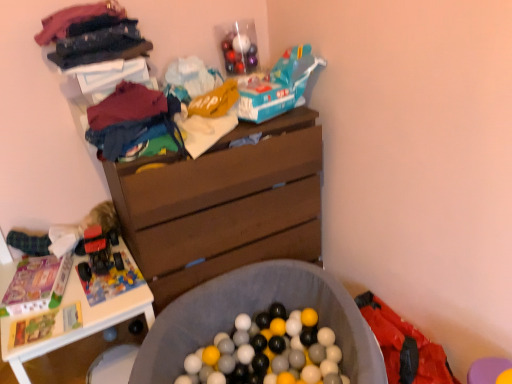
In order to click on shiny red plastic toy car at left, which is the 2th toy car from right to left in this screenshot , I will do `click(99, 253)`.

Describe the element at coordinates (404, 346) in the screenshot. I see `red fabric underclothes at lower right` at that location.

This screenshot has width=512, height=384. Describe the element at coordinates (130, 118) in the screenshot. I see `matte cotton t-shirt at upper left, the 1th clothing positioned from the bottom` at that location.

The image size is (512, 384). Find the location of `velvet-like fabric at upper left, which appears as the second clothing when ordered from the bottom`. velvet-like fabric at upper left, which appears as the second clothing when ordered from the bottom is located at coordinates (75, 19).

Describe the element at coordinates (257, 311) in the screenshot. I see `soft gray fabric ball pit at center` at that location.

Where is `brown wood chest of drawers at center`? brown wood chest of drawers at center is located at coordinates (223, 205).

What is the approximate width of white plastic table at lower left?

white plastic table at lower left is 23.99 inches wide.

Locate an element on the screen. Image resolution: width=512 pixels, height=384 pixels. white plastic table at lower left is located at coordinates (84, 322).

Locate an element on the screen. Image resolution: width=512 pixels, height=384 pixels. shiny red plastic toy car at left, which is the 2th toy car in top-to-bottom order is located at coordinates (99, 253).

Can you confirm if velvet-like fabric at upper left, the first clothing from the top, is positioned to the left of red fabric underclothes at lower right?

Yes, velvet-like fabric at upper left, the first clothing from the top, is to the left of red fabric underclothes at lower right.

Considering their positions, is velvet-like fabric at upper left, which appears as the second clothing when ordered from the bottom, located in front of or behind red fabric underclothes at lower right?

Clearly, velvet-like fabric at upper left, which appears as the second clothing when ordered from the bottom, is behind red fabric underclothes at lower right.

The height and width of the screenshot is (384, 512). Identify the location of clothing that is the 2nd object to the left of the red fabric underclothes at lower right, starting at the anchor. (75, 19).

In the scene shown: Could you measure the distance between shiny red plastic toy car at left, the first toy car ordered from the bottom, and brown wood chest of drawers at center?

A distance of 20.56 inches exists between shiny red plastic toy car at left, the first toy car ordered from the bottom, and brown wood chest of drawers at center.

In the scene shown: Would you say shiny red plastic toy car at left, which ranks as the first toy car in left-to-right order, contains brown wood chest of drawers at center?

No.

Is there a large distance between shiny red plastic toy car at left, the first toy car ordered from the bottom, and brown wood chest of drawers at center?

No, there isn't a large distance between shiny red plastic toy car at left, the first toy car ordered from the bottom, and brown wood chest of drawers at center.

Does point (86, 269) come farther from viewer compared to point (181, 288)?

Yes, it is behind point (181, 288).

Is white plastic table at lower left further to the viewer compared to velvet-like fabric at upper left, which appears as the second clothing when ordered from the bottom?

Yes, white plastic table at lower left is further from the camera.

From a real-world perspective, who is located higher, white plastic table at lower left or velvet-like fabric at upper left, which appears as the second clothing when ordered from the bottom?

velvet-like fabric at upper left, which appears as the second clothing when ordered from the bottom.

Who is smaller, white plastic table at lower left or velvet-like fabric at upper left, the first clothing from the top?

With smaller size is velvet-like fabric at upper left, the first clothing from the top.

At what (x,y) coordinates should I click in order to perform the action: click on clothing that is the 1st one when counting forward from the teal plastic toy car at upper center, placed as the first toy car when sorted from top to bottom. Please return your answer as a coordinate pair (x, y). The image size is (512, 384). Looking at the image, I should click on (75, 19).

Based on the photo, from the image's perspective, which is above, teal plastic toy car at upper center, arranged as the 1th toy car when viewed from the right, or velvet-like fabric at upper left, which appears as the second clothing when ordered from the bottom?

velvet-like fabric at upper left, which appears as the second clothing when ordered from the bottom, from the image's perspective.

From a real-world perspective, is teal plastic toy car at upper center, the second toy car ordered from the bottom, below velvet-like fabric at upper left, which appears as the second clothing when ordered from the bottom?

Yes, from a real-world perspective, teal plastic toy car at upper center, the second toy car ordered from the bottom, is below velvet-like fabric at upper left, which appears as the second clothing when ordered from the bottom.

Is velvet-like fabric at upper left, the first clothing from the top, a part of teal plastic toy car at upper center, arranged as the 1th toy car when viewed from the right?

Actually, velvet-like fabric at upper left, the first clothing from the top, is outside teal plastic toy car at upper center, arranged as the 1th toy car when viewed from the right.

Is teal plastic toy car at upper center, the second toy car ordered from the bottom, oriented away from shiny red plastic toy car at left, which is the 2th toy car in top-to-bottom order?

That's not correct — teal plastic toy car at upper center, the second toy car ordered from the bottom, is not looking away from shiny red plastic toy car at left, which is the 2th toy car in top-to-bottom order.

Is teal plastic toy car at upper center, arranged as the 2th toy car when viewed from the left, located outside shiny red plastic toy car at left, the first toy car ordered from the bottom?

Yes, teal plastic toy car at upper center, arranged as the 2th toy car when viewed from the left, is outside of shiny red plastic toy car at left, the first toy car ordered from the bottom.

Between teal plastic toy car at upper center, arranged as the 1th toy car when viewed from the right, and shiny red plastic toy car at left, which is the 2th toy car in top-to-bottom order, which one has larger size?

teal plastic toy car at upper center, arranged as the 1th toy car when viewed from the right, is bigger.

At what (x,y) coordinates should I click in order to perform the action: click on toy car beneath the teal plastic toy car at upper center, arranged as the 2th toy car when viewed from the left (from a real-world perspective). Please return your answer as a coordinate pair (x, y). Looking at the image, I should click on (99, 253).

How many degrees apart are the facing directions of white plastic table at lower left and teal plastic toy car at upper center, arranged as the 1th toy car when viewed from the right?

19.3 degrees separate the facing orientations of white plastic table at lower left and teal plastic toy car at upper center, arranged as the 1th toy car when viewed from the right.

From a real-world perspective, is white plastic table at lower left positioned under teal plastic toy car at upper center, the second toy car ordered from the bottom, based on gravity?

Yes, from a real-world perspective, white plastic table at lower left is below teal plastic toy car at upper center, the second toy car ordered from the bottom.

From the image's perspective, is white plastic table at lower left located above teal plastic toy car at upper center, placed as the first toy car when sorted from top to bottom?

No, from the image's perspective, white plastic table at lower left is not on top of teal plastic toy car at upper center, placed as the first toy car when sorted from top to bottom.

Is white plastic table at lower left looking in the opposite direction of teal plastic toy car at upper center, arranged as the 2th toy car when viewed from the left?

No, teal plastic toy car at upper center, arranged as the 2th toy car when viewed from the left, is not at the back of white plastic table at lower left.

Which object is further away from the camera, brown wood chest of drawers at center or matte cotton t-shirt at upper left, which ranks as the 2th clothing in top-to-bottom order?

brown wood chest of drawers at center is more distant.

Is point (191, 168) closer to viewer compared to point (130, 122)?

That is False.

Is brown wood chest of drawers at center oriented towards matte cotton t-shirt at upper left, which ranks as the 2th clothing in top-to-bottom order?

No, brown wood chest of drawers at center is not turned towards matte cotton t-shirt at upper left, which ranks as the 2th clothing in top-to-bottom order.

Is brown wood chest of drawers at center not within matte cotton t-shirt at upper left, which ranks as the 2th clothing in top-to-bottom order?

brown wood chest of drawers at center lies outside matte cotton t-shirt at upper left, which ranks as the 2th clothing in top-to-bottom order,'s area.

Find the location of a particular element. clothing that is the 2nd one when counting leftward from the red fabric underclothes at lower right is located at coordinates click(75, 19).

The width and height of the screenshot is (512, 384). In the image, there is a shiny red plastic toy car at left, which is the 2th toy car from right to left. In order to click on the chest of drawers above it (from the image's perspective) in this screenshot , I will do `click(223, 205)`.

Estimate the real-world distances between objects in this image. Which object is closer to velvet-like fabric at upper left, the first clothing from the top, red fabric underclothes at lower right or matte cotton t-shirt at upper left, which ranks as the 2th clothing in top-to-bottom order?

matte cotton t-shirt at upper left, which ranks as the 2th clothing in top-to-bottom order.

From the image, which object appears to be farther from white plastic table at lower left, brown wood chest of drawers at center or teal plastic toy car at upper center, the second toy car ordered from the bottom?

Among the two, teal plastic toy car at upper center, the second toy car ordered from the bottom, is located further to white plastic table at lower left.

Which object lies further to the anchor point shiny red plastic toy car at left, the first toy car ordered from the bottom, velvet-like fabric at upper left, the first clothing from the top, or white plastic table at lower left?

velvet-like fabric at upper left, the first clothing from the top, is further to shiny red plastic toy car at left, the first toy car ordered from the bottom.

From the picture: Which object lies further to the anchor point shiny red plastic toy car at left, which is the 2th toy car in top-to-bottom order, teal plastic toy car at upper center, arranged as the 2th toy car when viewed from the left, or white plastic table at lower left?

Among the two, teal plastic toy car at upper center, arranged as the 2th toy car when viewed from the left, is located further to shiny red plastic toy car at left, which is the 2th toy car in top-to-bottom order.

When comparing their distances from matte cotton t-shirt at upper left, the 1th clothing positioned from the bottom, does velvet-like fabric at upper left, which appears as the second clothing when ordered from the bottom, or soft gray fabric ball pit at center seem further?

soft gray fabric ball pit at center is positioned further to the anchor matte cotton t-shirt at upper left, the 1th clothing positioned from the bottom.

Based on their spatial positions, is soft gray fabric ball pit at center or velvet-like fabric at upper left, the first clothing from the top, further from matte cotton t-shirt at upper left, which ranks as the 2th clothing in top-to-bottom order?

Among the two, soft gray fabric ball pit at center is located further to matte cotton t-shirt at upper left, which ranks as the 2th clothing in top-to-bottom order.

Consider the image. Looking at the image, which one is located closer to shiny red plastic toy car at left, which is the 2th toy car from right to left, white plastic table at lower left or soft gray fabric ball pit at center?

white plastic table at lower left.

Based on their spatial positions, is matte cotton t-shirt at upper left, which ranks as the 2th clothing in top-to-bottom order, or teal plastic toy car at upper center, placed as the first toy car when sorted from top to bottom, closer to white plastic table at lower left?

matte cotton t-shirt at upper left, which ranks as the 2th clothing in top-to-bottom order, is positioned closer to the anchor white plastic table at lower left.

Where is `clothing between velvet-like fabric at upper left, the first clothing from the top, and soft gray fabric ball pit at center in the up-down direction`? Image resolution: width=512 pixels, height=384 pixels. clothing between velvet-like fabric at upper left, the first clothing from the top, and soft gray fabric ball pit at center in the up-down direction is located at coordinates (130, 118).

Identify the location of the chest of drawers that lies between teal plastic toy car at upper center, arranged as the 1th toy car when viewed from the right, and red fabric underclothes at lower right from top to bottom. This screenshot has height=384, width=512. (223, 205).

The image size is (512, 384). I want to click on chest of drawers between matte cotton t-shirt at upper left, which ranks as the 2th clothing in top-to-bottom order, and red fabric underclothes at lower right from left to right, so click(x=223, y=205).

Identify the location of the chest of drawers located between white plastic table at lower left and soft gray fabric ball pit at center in the left-right direction. (223, 205).